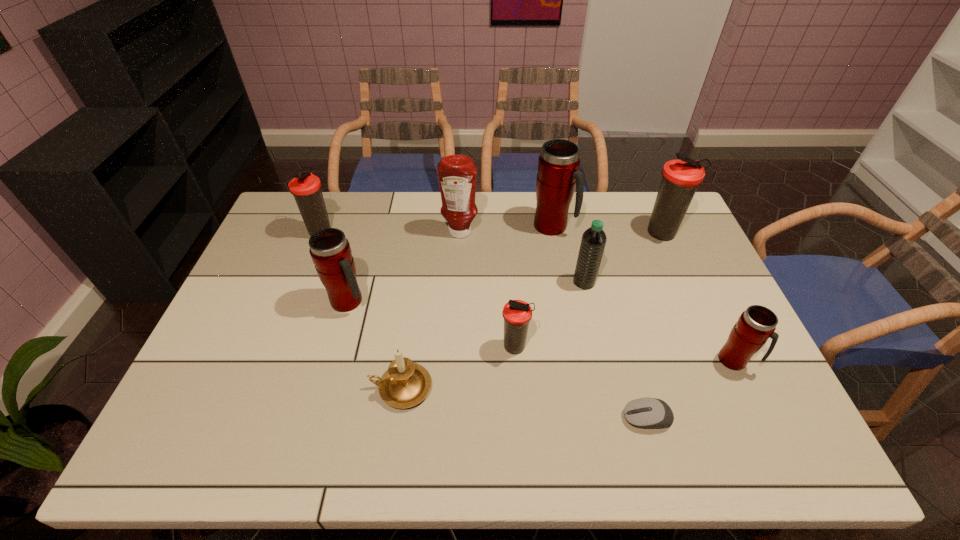
At what (x,y) coordinates should I click in order to perform the action: click on the second brown thermos bottle from left to right. Please return your answer as a coordinate pair (x, y). Looking at the image, I should click on (516, 313).

Image resolution: width=960 pixels, height=540 pixels. Find the location of `the smallest red thermos bottle`. the smallest red thermos bottle is located at coordinates (755, 325).

The width and height of the screenshot is (960, 540). I want to click on the nearest red thermos bottle, so click(755, 325).

I want to click on candle holder, so click(x=405, y=384).

Locate an element on the screen. The image size is (960, 540). the shortest object is located at coordinates (647, 413).

The image size is (960, 540). Find the location of `free space located 0.060m on the front of the biggest brown thermos bottle`. free space located 0.060m on the front of the biggest brown thermos bottle is located at coordinates (674, 260).

Where is `blank area located 0.120m on the side with the handle of the fourth thermos bottle from left to right`? blank area located 0.120m on the side with the handle of the fourth thermos bottle from left to right is located at coordinates (608, 226).

At what (x,y) coordinates should I click in order to perform the action: click on free region located on the right of the condiment. Please return your answer as a coordinate pair (x, y). The image size is (960, 540). Looking at the image, I should click on (571, 233).

Where is `free space located on the right of the second biggest brown thermos bottle`? The image size is (960, 540). free space located on the right of the second biggest brown thermos bottle is located at coordinates coord(408,231).

Identify the location of vacant space located 0.280m on the side with the handle of the second thermos bottle from left to right. (464, 302).